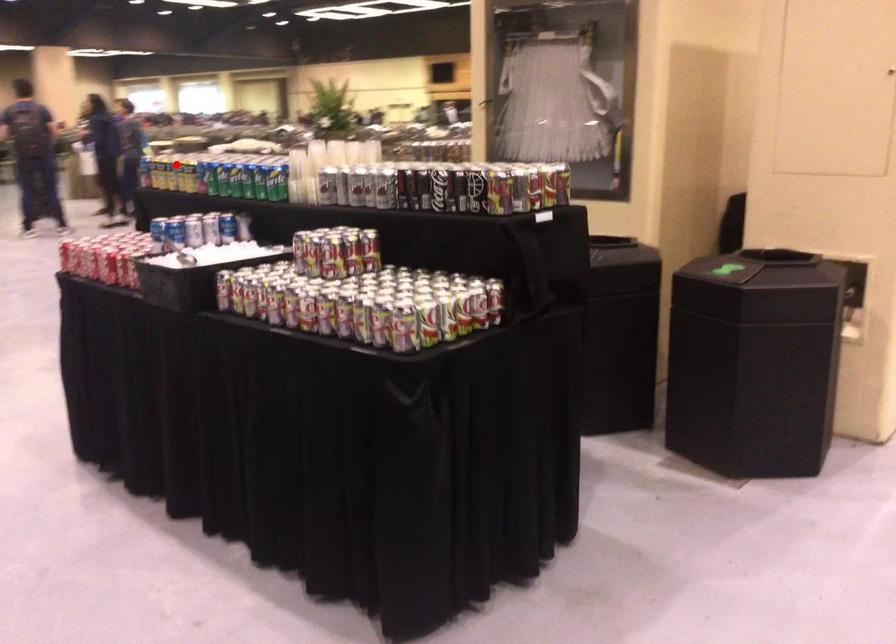
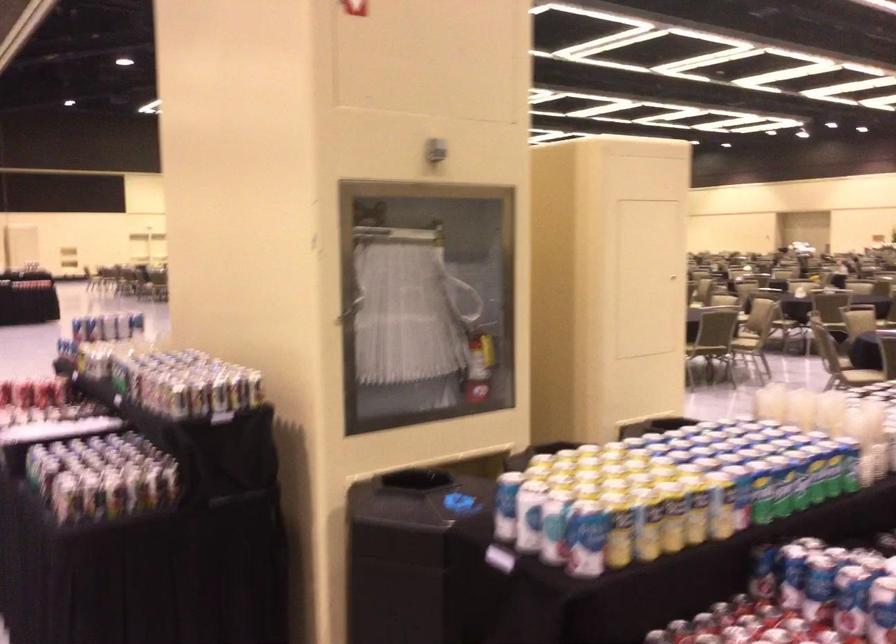
In the second image, find the point that corresponds to the highlighted location in the first image.

(695, 509)